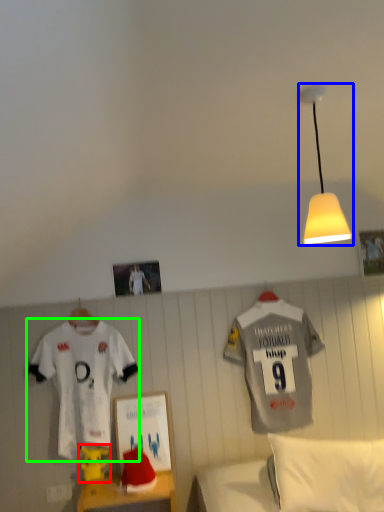
Question: Which is farther away from toy (highlighted by a red box)? lamp (highlighted by a blue box) or sports uniform (highlighted by a green box)?

Choices:
 (A) lamp
 (B) sports uniform

Answer: (A)